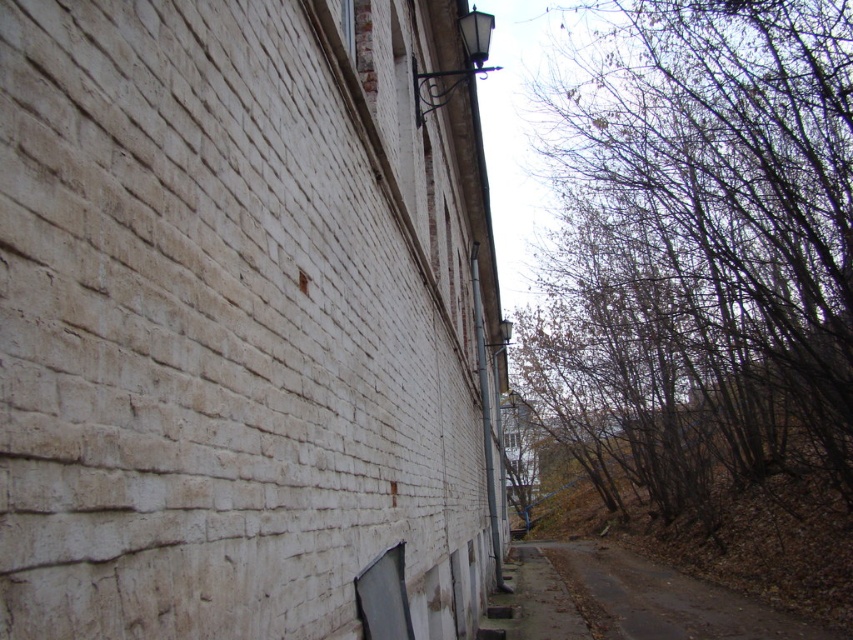
Question: Among these objects, which one is nearest to the camera?

Choices:
 (A) brown dirt road at lower right
 (B) brown leafless trees at upper right

Answer: (A)

Question: Can you confirm if brown leafless trees at upper right is wider than brown dirt road at lower right?

Choices:
 (A) no
 (B) yes

Answer: (B)

Question: Does brown leafless trees at upper right appear on the right side of brown dirt road at lower right?

Choices:
 (A) yes
 (B) no

Answer: (A)

Question: Considering the relative positions of brown leafless trees at upper right and brown dirt road at lower right in the image provided, where is brown leafless trees at upper right located with respect to brown dirt road at lower right?

Choices:
 (A) left
 (B) right

Answer: (B)